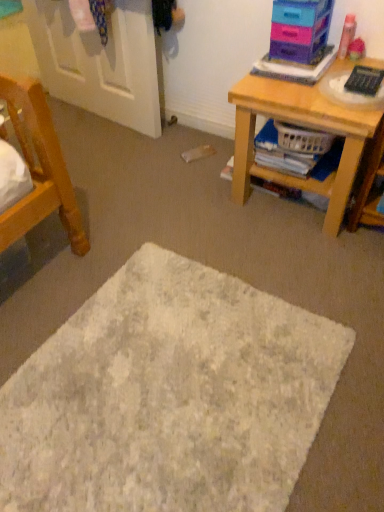
I want to click on blank space situated above white textured mat at center (from a real-world perspective), so tap(155, 377).